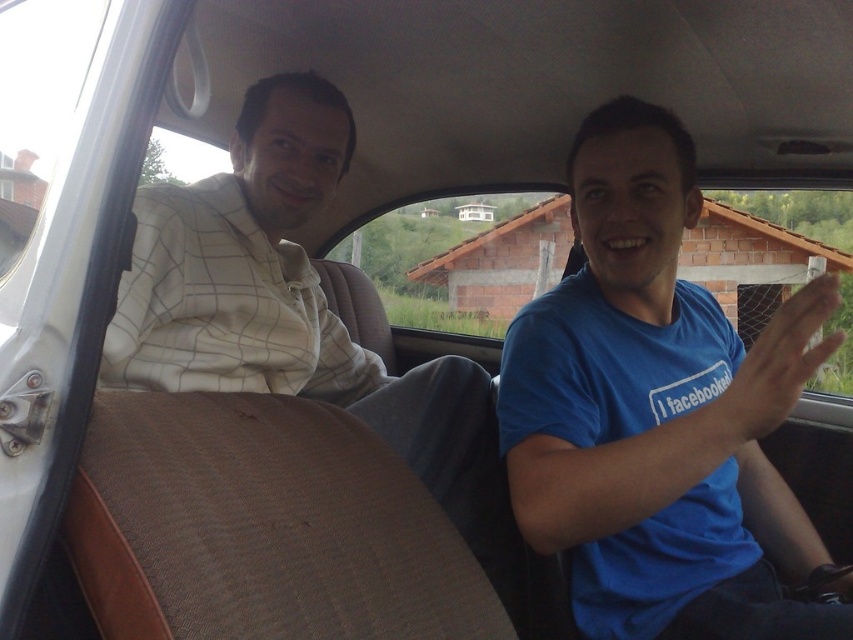
Based on the photo, you are a passenger in the car and want to hand a map to the person wearing the blue cotton shirt at center. Which direction should you move your hand to reach them?

The blue cotton shirt at center is located at point [659,412], so you should move your hand towards the center of the car to reach them.

You are a fashion designer observing two shirts in the image. The blue cotton shirt at center and the white checkered shirt at center. Which shirt is narrower?

The blue cotton shirt at center is narrower than the white checkered shirt at center.